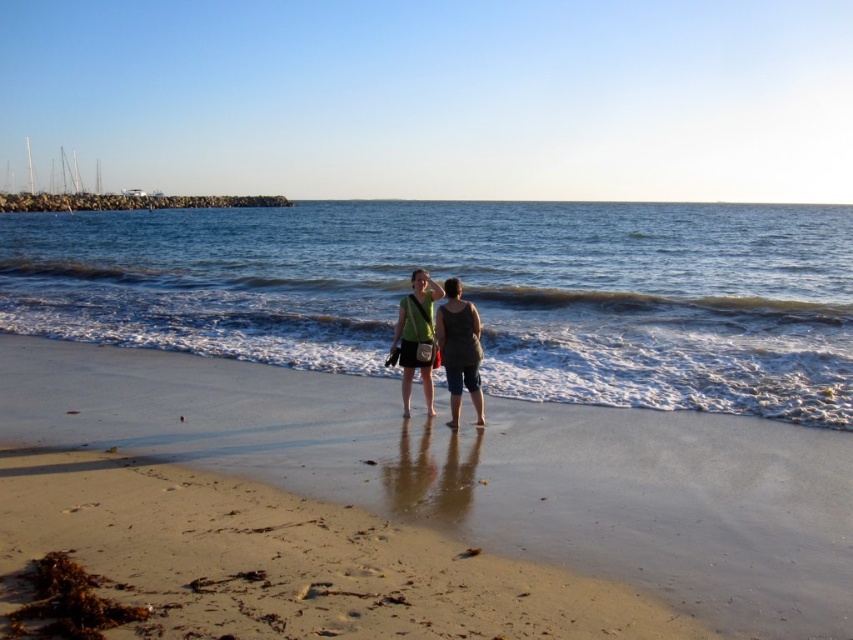
Who is positioned more to the left, sandy beach at center or matte gray tank top at center?

sandy beach at center

Who is lower down, sandy beach at center or matte gray tank top at center?

sandy beach at center is below.

Which is in front, point (776, 476) or point (451, 284)?

Point (776, 476) is more forward.

The width and height of the screenshot is (853, 640). In order to click on sandy beach at center in this screenshot , I will do click(x=490, y=470).

Who is shorter, clear blue water at center or green fabric dress at center?

Standing shorter between the two is green fabric dress at center.

Is point (845, 404) in front of point (462, 337)?

That is False.

Locate an element on the screen. Image resolution: width=853 pixels, height=640 pixels. clear blue water at center is located at coordinates (471, 292).

Which is below, clear blue water at center or matte gray tank top at center?

Positioned lower is matte gray tank top at center.

Does clear blue water at center have a greater height compared to matte gray tank top at center?

Yes.

Measure the distance between clear blue water at center and camera.

A distance of 9.86 meters exists between clear blue water at center and camera.

You are a GUI agent. You are given a task and a screenshot of the screen. Output one action in this format:
    pyautogui.click(x=<x>, y=<y>)
    Task: Click on the clear blue water at center
    
    Given the screenshot: What is the action you would take?
    pyautogui.click(x=471, y=292)